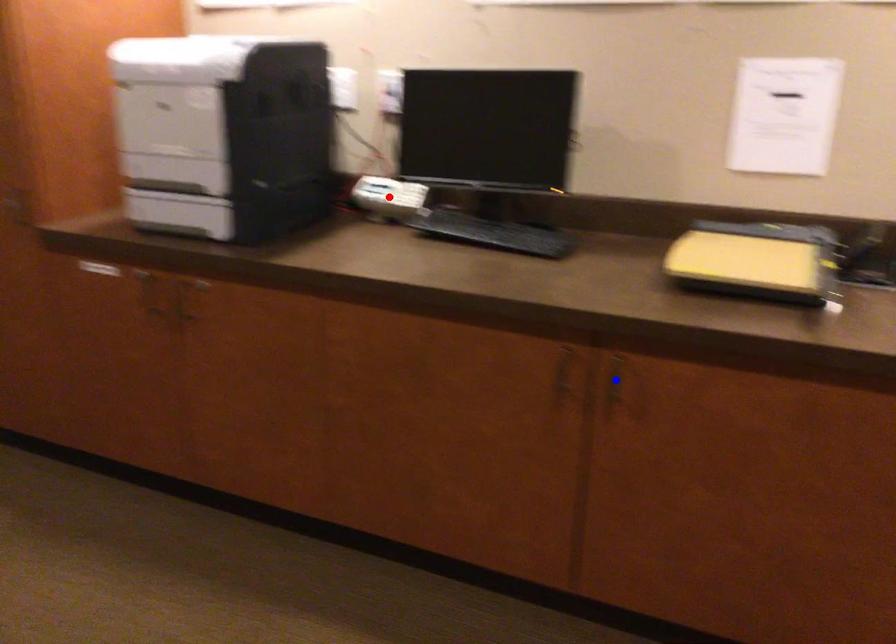
Question: In the image, two points are highlighted. Which point is nearer to the camera? Reply with the corresponding letter.

Choices:
 (A) blue point
 (B) red point

Answer: (A)